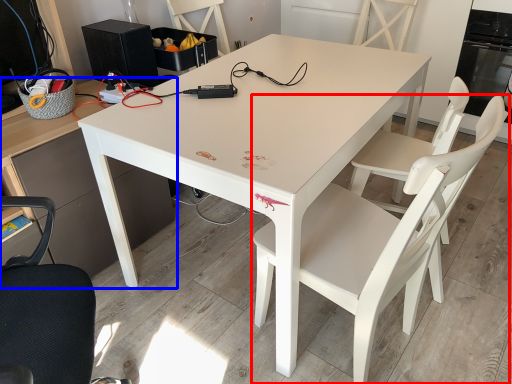
Question: Among these objects, which one is farthest to the camera, chair (highlighted by a red box) or desk (highlighted by a blue box)?

Choices:
 (A) chair
 (B) desk

Answer: (A)